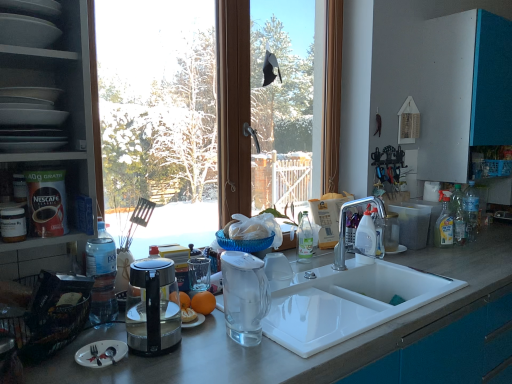
This screenshot has width=512, height=384. Identify the location of free space in front of silver matte fork at lower left. (83, 374).